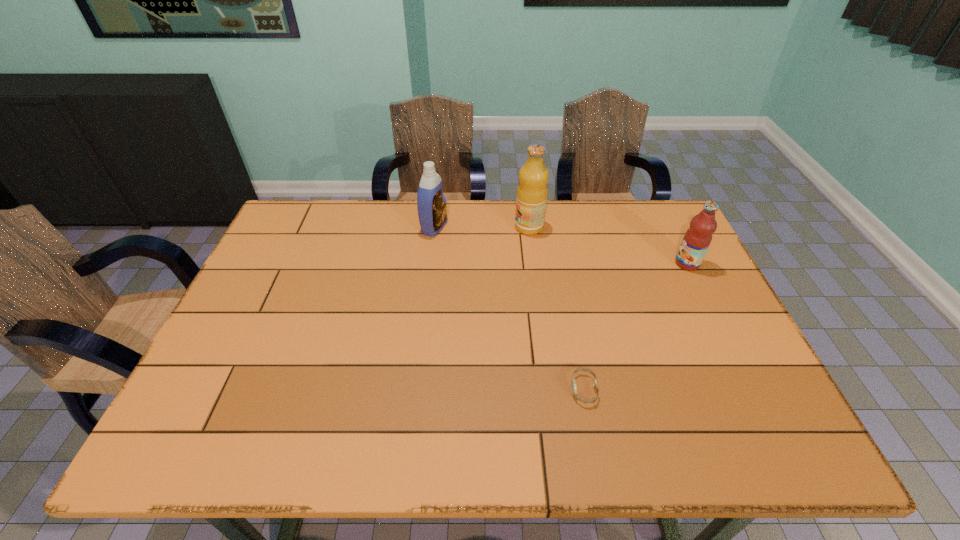
Image resolution: width=960 pixels, height=540 pixels. In order to click on the taller fruit juice in this screenshot , I will do `click(532, 191)`.

Find the location of a particular element. The image size is (960, 540). the left fruit juice is located at coordinates (532, 191).

This screenshot has width=960, height=540. I want to click on the leftmost object, so click(x=432, y=209).

Find the location of `the second nearest object`. the second nearest object is located at coordinates (697, 239).

The image size is (960, 540). Identify the location of the right fruit juice. (697, 239).

Identify the location of the shortest object. (573, 383).

Image resolution: width=960 pixels, height=540 pixels. I want to click on watch, so point(573,383).

Where is `vacant space located 0.260m on the front label of the tallest object`? Image resolution: width=960 pixels, height=540 pixels. vacant space located 0.260m on the front label of the tallest object is located at coordinates (435, 227).

The width and height of the screenshot is (960, 540). What are the coordinates of `free space located 0.280m on the front label of the tallest object` in the screenshot? It's located at click(429, 227).

The image size is (960, 540). In order to click on free spot located on the front label of the tallest object in this screenshot , I will do `click(499, 227)`.